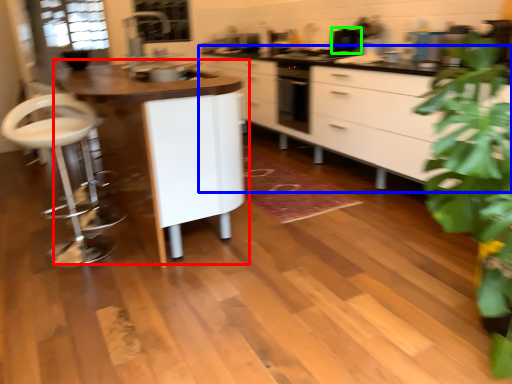
Question: Estimate the real-world distances between objects in this image. Which object is farther from table (highlighted by a red box), cabinetry (highlighted by a blue box) or appliance (highlighted by a green box)?

Choices:
 (A) cabinetry
 (B) appliance

Answer: (B)